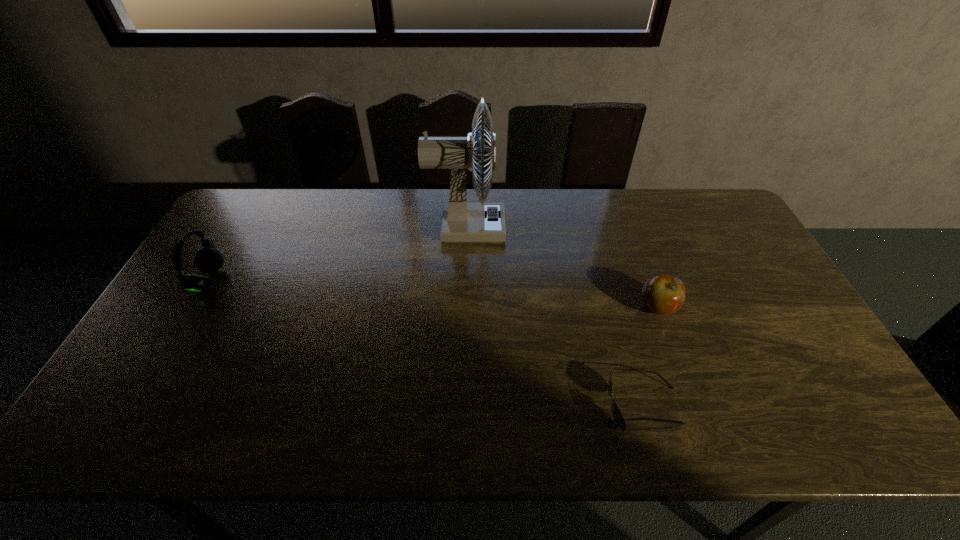
Find the location of a particular element. The image size is (960, 540). vacant area that lies between the apple and the sunglasses is located at coordinates (651, 357).

Find the location of a particular element. Image resolution: width=960 pixels, height=540 pixels. free space between the fan and the headset is located at coordinates (337, 254).

Image resolution: width=960 pixels, height=540 pixels. I want to click on empty space that is in between the nearest object and the leftmost object, so click(x=426, y=343).

The height and width of the screenshot is (540, 960). I want to click on blank region between the third shortest object and the tallest object, so click(337, 254).

Identify the location of vacant region between the apple and the sunglasses. The width and height of the screenshot is (960, 540). (651, 357).

Identify the location of vacant space that's between the apple and the nearest object. This screenshot has width=960, height=540. (651, 357).

Find the location of a particular element. The width and height of the screenshot is (960, 540). free space between the apple and the headset is located at coordinates (433, 294).

What are the coordinates of `vacant area between the sunglasses and the third object from right to left` in the screenshot? It's located at (555, 317).

Locate an element on the screen. This screenshot has width=960, height=540. vacant area between the farthest object and the second shortest object is located at coordinates (562, 268).

Where is `vacant area that lies between the farthest object and the third tallest object`? This screenshot has width=960, height=540. vacant area that lies between the farthest object and the third tallest object is located at coordinates (562, 268).